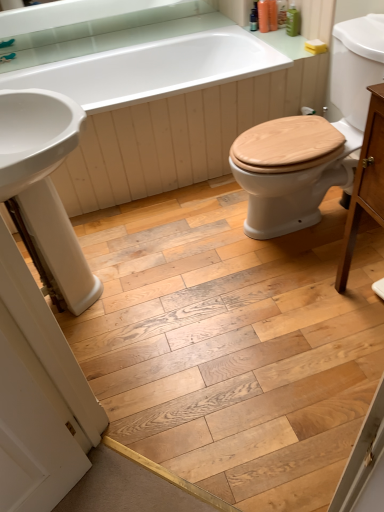
At what (x,y) coordinates should I click in order to perform the action: click on vacant region below light brown wood cabinet at right (from a real-world perspective). Please return your answer as a coordinate pair (x, y). Image resolution: width=384 pixels, height=512 pixels. Looking at the image, I should click on (367, 307).